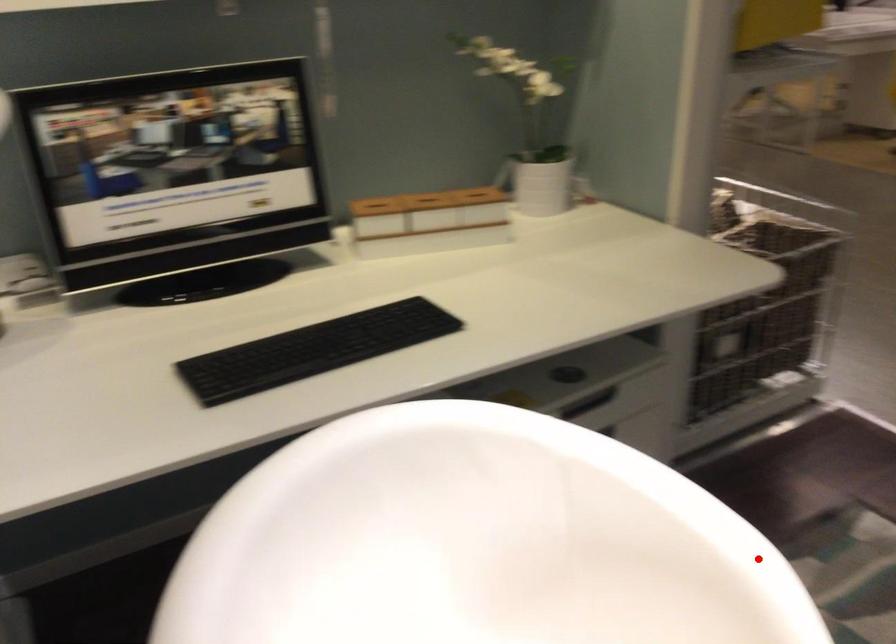
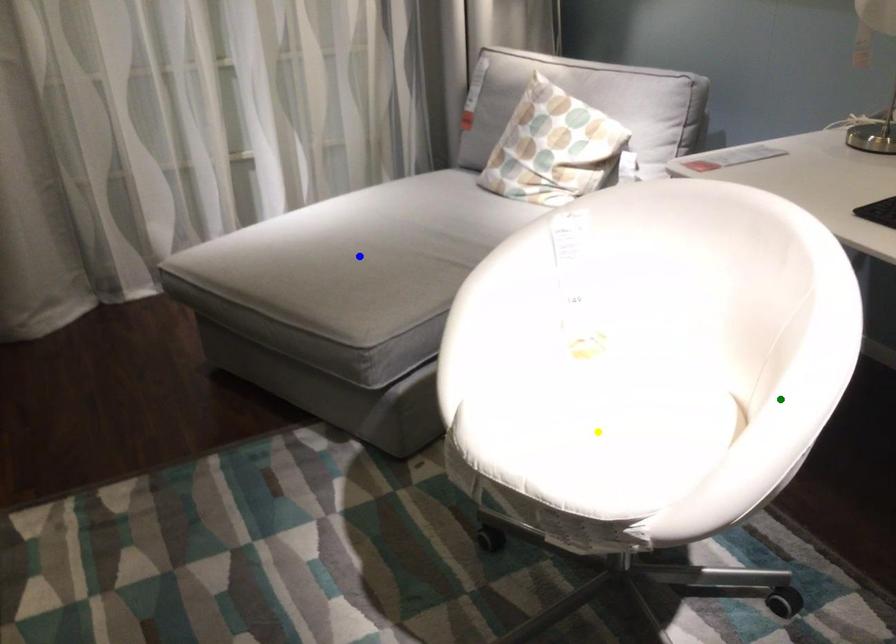
Question: I am providing you with two images of the same scene from different viewpoints. A red point is marked on the first image. You are given multiple points on the second image. Which mark in image 2 goes with the point in image 1?

Choices:
 (A) green point
 (B) yellow point
 (C) blue point

Answer: (A)